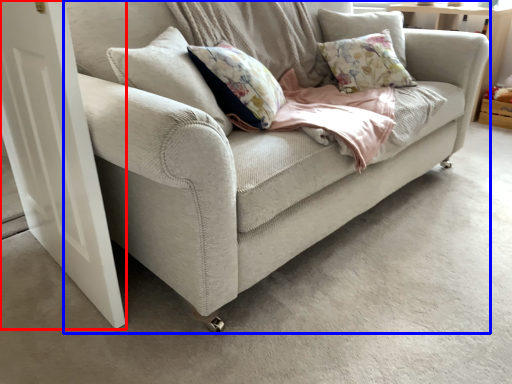
Question: Among these objects, which one is farthest to the camera, screen door (highlighted by a red box) or studio couch (highlighted by a blue box)?

Choices:
 (A) screen door
 (B) studio couch

Answer: (A)